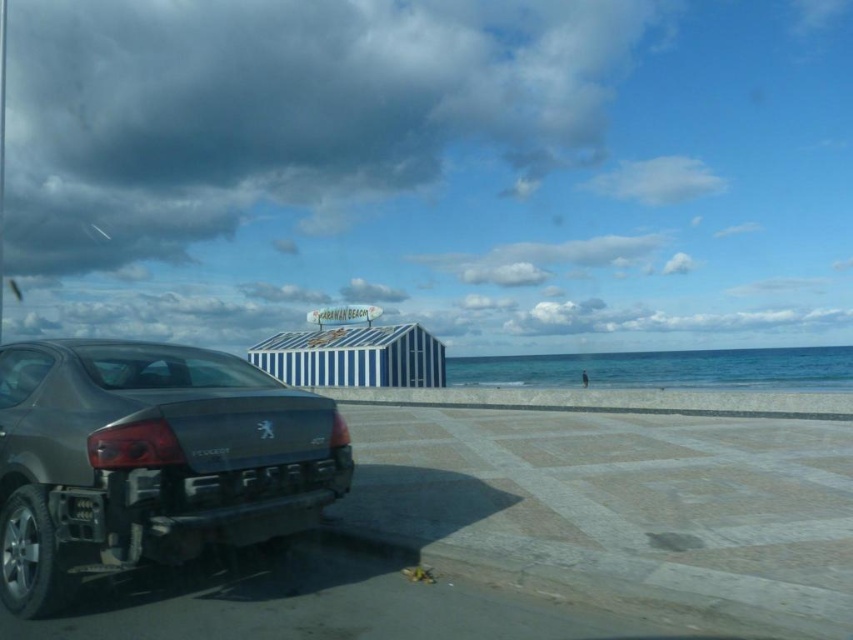
Question: Which point is farther to the camera?

Choices:
 (A) (61, 516)
 (B) (271, 486)

Answer: (B)

Question: Does white sand beach at lower right appear over black plastic license plate at lower left?

Choices:
 (A) no
 (B) yes

Answer: (A)

Question: Can you confirm if white sand beach at lower right is positioned to the left of matte gray car at lower left?

Choices:
 (A) no
 (B) yes

Answer: (A)

Question: Does matte gray car at lower left have a greater width compared to black plastic license plate at lower left?

Choices:
 (A) no
 (B) yes

Answer: (B)

Question: Which point is farther to the camera?

Choices:
 (A) black plastic license plate at lower left
 (B) white sand beach at lower right

Answer: (A)

Question: Estimate the real-world distances between objects in this image. Which object is closer to the black plastic license plate at lower left?

Choices:
 (A) white sand beach at lower right
 (B) matte gray car at lower left

Answer: (B)